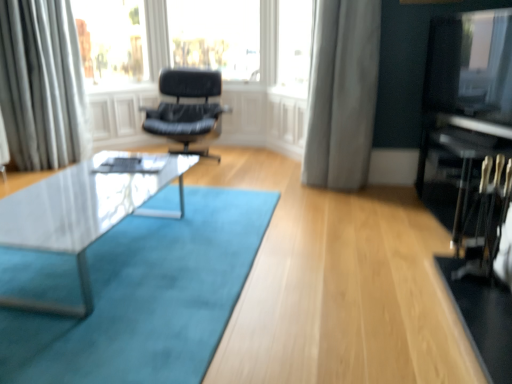
Question: Can you confirm if white glossy coffee table at center is shorter than clear glass window at upper center?

Choices:
 (A) no
 (B) yes

Answer: (B)

Question: Is white glossy coffee table at center positioned far away from clear glass window at upper center?

Choices:
 (A) yes
 (B) no

Answer: (A)

Question: Can you confirm if white glossy coffee table at center is positioned to the left of clear glass window at upper center?

Choices:
 (A) no
 (B) yes

Answer: (B)

Question: Is white glossy coffee table at center smaller than clear glass window at upper center?

Choices:
 (A) yes
 (B) no

Answer: (B)

Question: Does white glossy coffee table at center come in front of clear glass window at upper center?

Choices:
 (A) yes
 (B) no

Answer: (A)

Question: Does white glossy coffee table at center have a greater height compared to clear glass window at upper center?

Choices:
 (A) yes
 (B) no

Answer: (B)

Question: Does clear glass window at upper center contain gray fabric curtain at center, the second curtain positioned from the left?

Choices:
 (A) yes
 (B) no

Answer: (B)

Question: Is clear glass window at upper center not within gray fabric curtain at center, the second curtain positioned from the left?

Choices:
 (A) no
 (B) yes

Answer: (B)

Question: Considering the relative sizes of clear glass window at upper center and gray fabric curtain at center, the second curtain positioned from the left, in the image provided, is clear glass window at upper center thinner than gray fabric curtain at center, the second curtain positioned from the left,?

Choices:
 (A) yes
 (B) no

Answer: (A)

Question: From the image's perspective, does clear glass window at upper center appear higher than gray fabric curtain at center, the second curtain positioned from the left?

Choices:
 (A) yes
 (B) no

Answer: (A)

Question: Considering the relative sizes of clear glass window at upper center and gray fabric curtain at center, the second curtain positioned from the left, in the image provided, is clear glass window at upper center wider than gray fabric curtain at center, the second curtain positioned from the left,?

Choices:
 (A) no
 (B) yes

Answer: (A)

Question: Can you confirm if clear glass window at upper center is positioned to the right of gray fabric curtain at center, the second curtain positioned from the left?

Choices:
 (A) no
 (B) yes

Answer: (A)

Question: Does transparent glass at upper left appear on the right side of silky white curtain at upper left, which is counted as the 1th curtain, starting from the left?

Choices:
 (A) no
 (B) yes

Answer: (B)